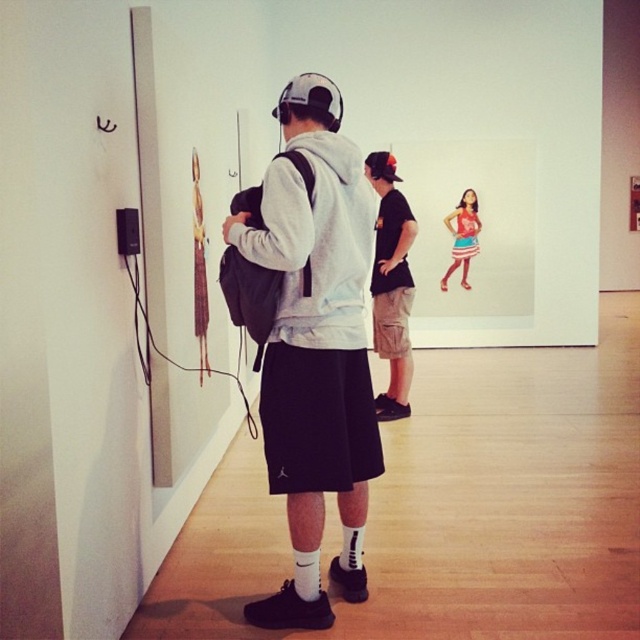
Question: Where is black cotton t-shirt at center located in relation to matte pink dress at center in the image?

Choices:
 (A) right
 (B) left

Answer: (B)

Question: Which is farther from the matte gray hoodie at center?

Choices:
 (A) matte pink dress at center
 (B) black cotton t-shirt at center

Answer: (A)

Question: Among these points, which one is nearest to the camera?

Choices:
 (A) (301, 413)
 (B) (401, 260)
 (C) (456, 264)

Answer: (A)

Question: Where is black cotton t-shirt at center located in relation to matte pink dress at center in the image?

Choices:
 (A) left
 (B) right

Answer: (A)

Question: Can you confirm if matte gray hoodie at center is positioned below black cotton t-shirt at center?

Choices:
 (A) yes
 (B) no

Answer: (A)

Question: Which object appears closest to the camera in this image?

Choices:
 (A) black cotton t-shirt at center
 (B) matte gray hoodie at center

Answer: (B)